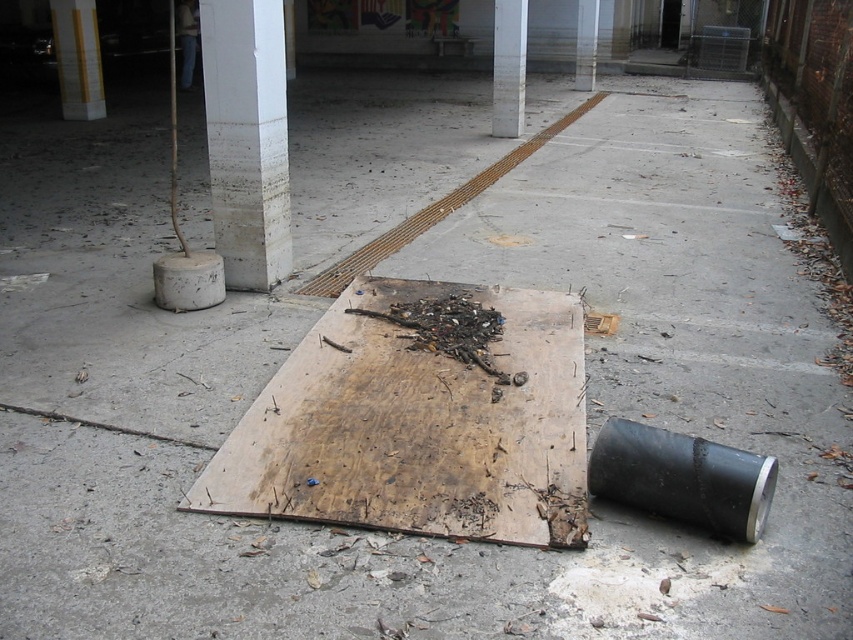
You are an inspector evaluating the structural integrity of the pillars in this parking garage. You notice two pillars labeled as white marble pillar at upper center and white smooth pillar at upper center. Which pillar should you prioritize inspecting first based on their height?

The white marble pillar at upper center should be prioritized for inspection first because it is taller than the white smooth pillar at upper center, making it potentially more critical to the structure.

You are a painter who needs to decide which object to paint first. Since you have limited time, you want to start with the larger one. Which object should you choose between the yellow painted wood at upper center and the white smooth pillar at upper center?

The yellow painted wood at upper center is bigger than the white smooth pillar at upper center, so you should start painting the yellow painted wood at upper center first.